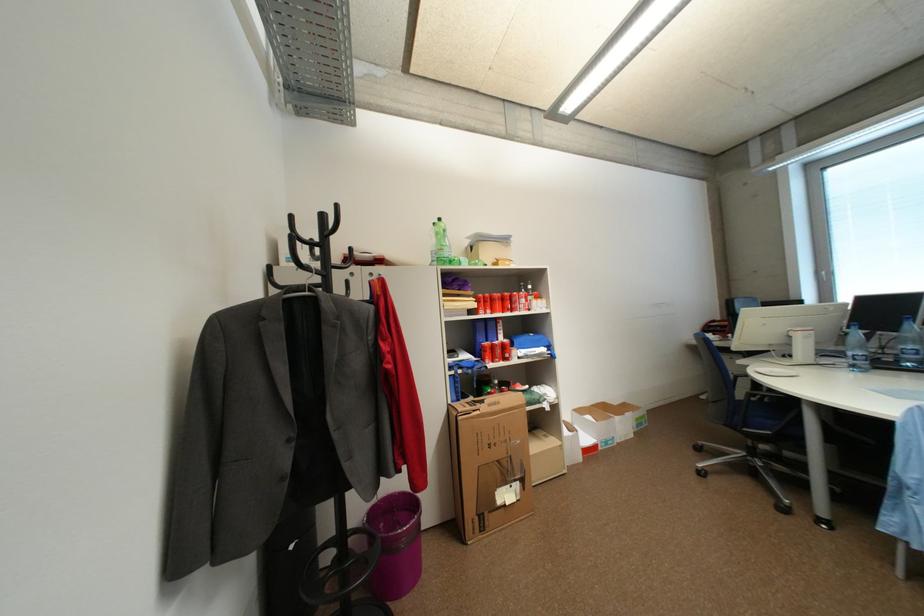
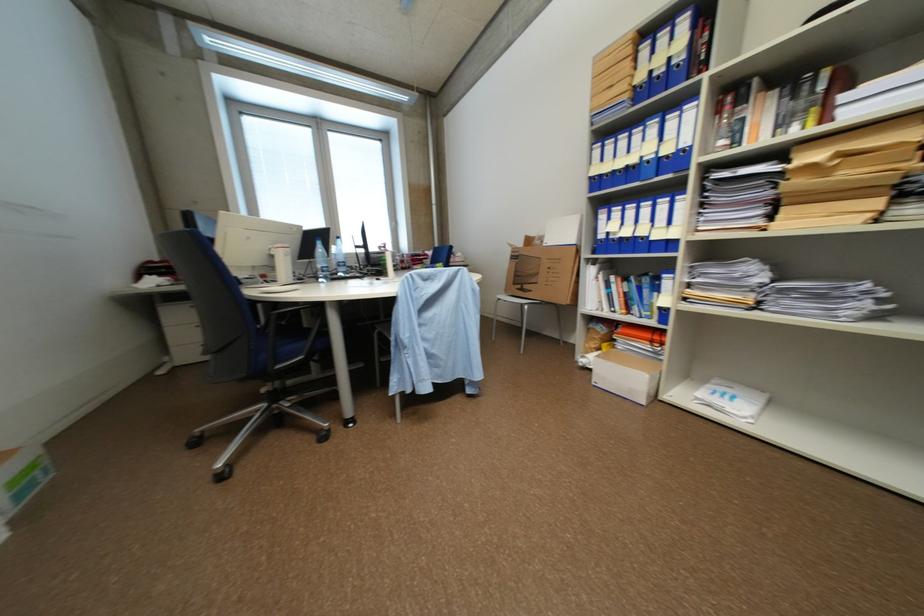
In the second image, find the point that corresponds to point 858,354 in the first image.

(327, 267)